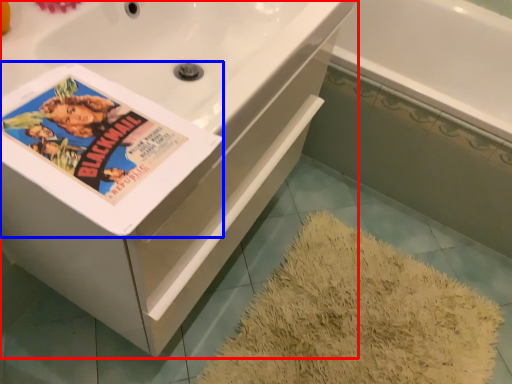
Question: Among these objects, which one is nearest to the camera, bathtub (highlighted by a red box) or paperback book (highlighted by a blue box)?

Choices:
 (A) bathtub
 (B) paperback book

Answer: (B)